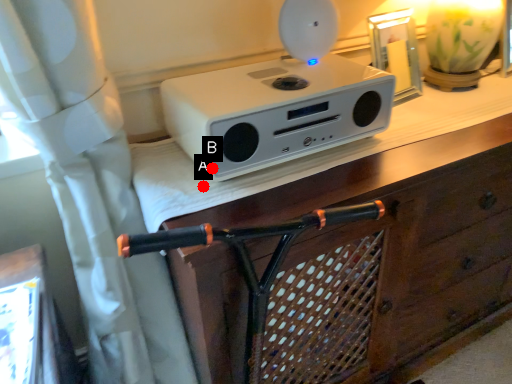
Question: Two points are circled on the image, labeled by A and B beside each circle. Which point is closer to the camera?

Choices:
 (A) A is closer
 (B) B is closer

Answer: (B)